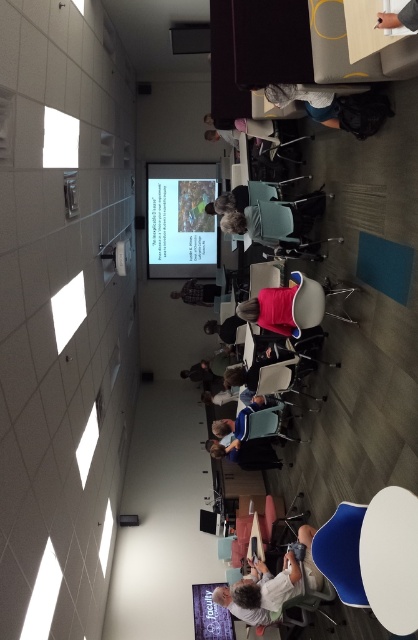
Can you confirm if pink fabric at center is smaller than dark gray fabric jacket at center?

Incorrect, pink fabric at center is not smaller in size than dark gray fabric jacket at center.

Does point (264, 300) come behind point (226, 326)?

No, it is in front of (226, 326).

Find the location of a particular element. The width and height of the screenshot is (418, 640). pink fabric at center is located at coordinates (270, 308).

Which of these two, blue fabric chair at lower right or denim shorts at center, stands shorter?

With less height is denim shorts at center.

The height and width of the screenshot is (640, 418). I want to click on blue fabric chair at lower right, so click(x=341, y=552).

Is point (359, 506) in front of point (283, 104)?

Yes, it is in front of point (283, 104).

Image resolution: width=418 pixels, height=640 pixels. I want to click on blue fabric chair at lower right, so click(x=341, y=552).

Between matte plastic projector screen at upper center and blue fabric chair at lower right, which one is positioned higher?

matte plastic projector screen at upper center

Who is positioned more to the left, matte plastic projector screen at upper center or blue fabric chair at lower right?

From the viewer's perspective, matte plastic projector screen at upper center appears more on the left side.

Who is more forward, (x=186, y=196) or (x=333, y=532)?

Point (x=333, y=532) is more forward.

Locate an element on the screen. matte plastic projector screen at upper center is located at coordinates (180, 220).